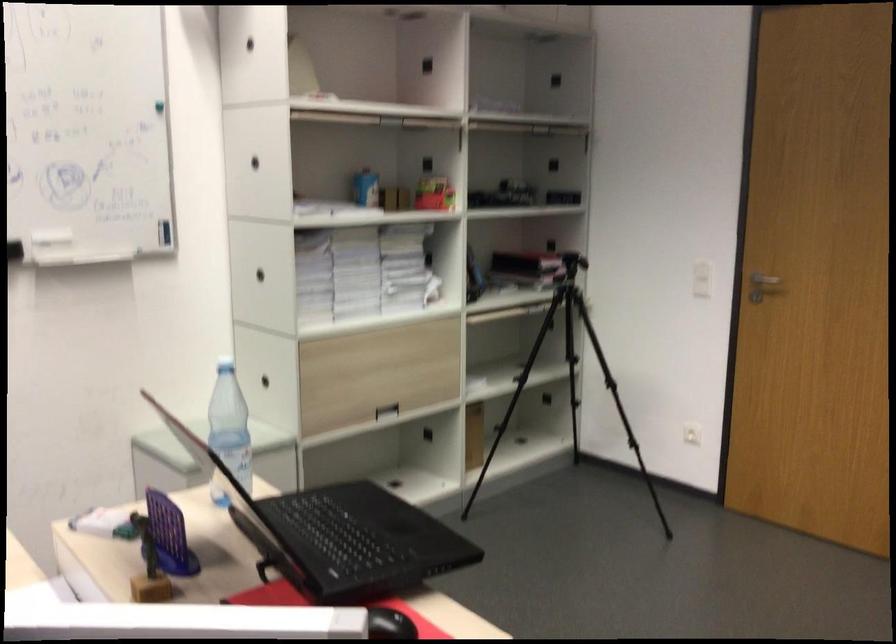
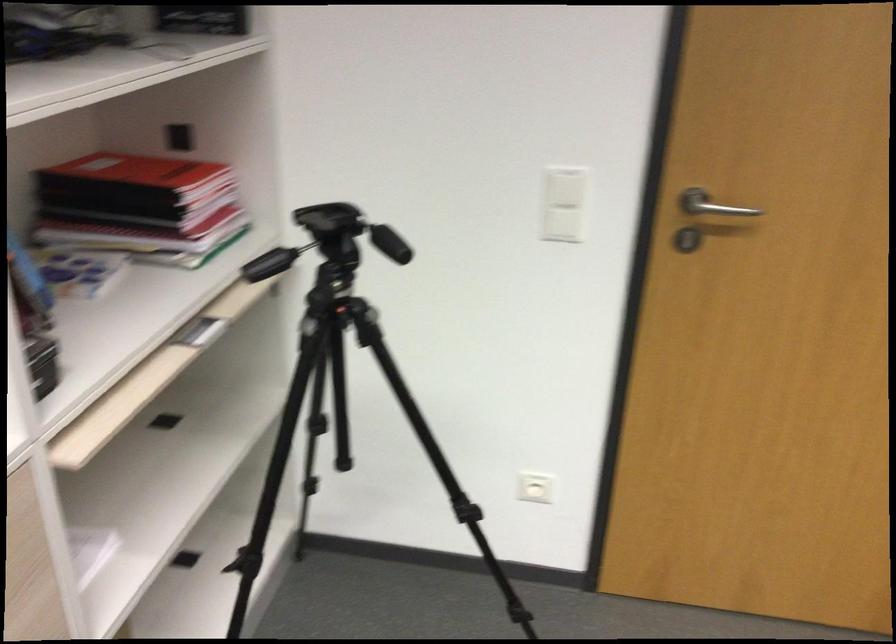
In the second image, find the point that corresponds to (x=538, y=251) in the first image.

(133, 172)